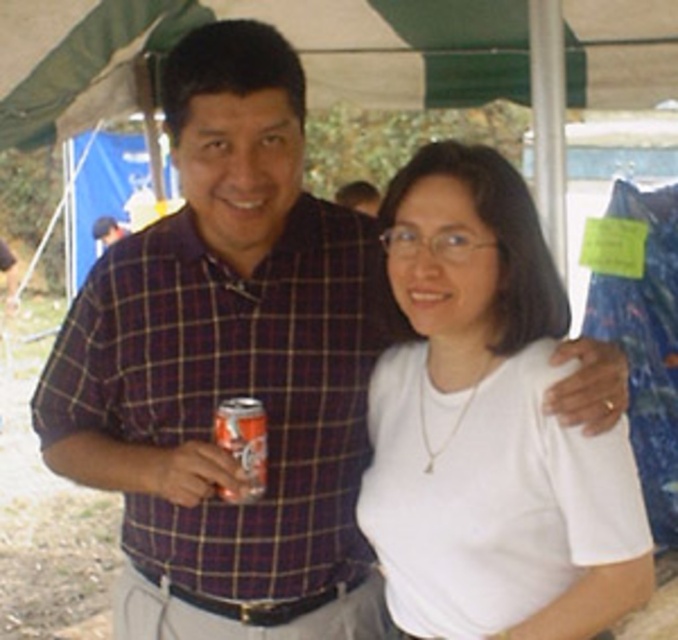
You are at an outdoor event and see the plaid cotton shirt at center and the orange aluminum can at center. Which object is positioned more to the left side?

The plaid cotton shirt at center is positioned to the left of the orange aluminum can at center, so it is more to the left side.

You are a photographer at an event and need to adjust the lighting to ensure both the white matte shirt at center and the plaid cotton shirt at center are visible. Given their positions, which shirt should you focus on first to avoid shadows?

The white matte shirt at center is located above the plaid cotton shirt at center, so focusing on the white matte shirt at center first will help prevent its shadow from falling onto the plaid cotton shirt at center.